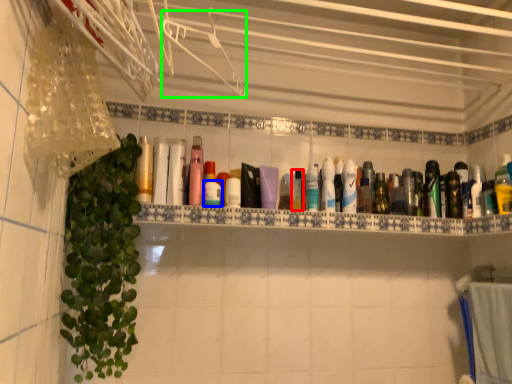
Question: Based on their relative distances, which object is nearer to mouthwash (highlighted by a red box)? Choose from mouthwash (highlighted by a blue box) and hanger (highlighted by a green box).

Choices:
 (A) mouthwash
 (B) hanger

Answer: (A)